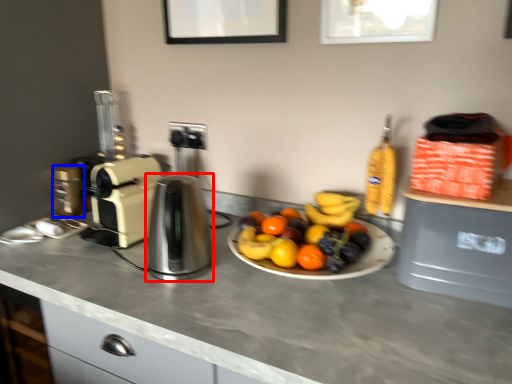
Question: Which of the following is the farthest to the observer, kitchen appliance (highlighted by a red box) or coffee machine (highlighted by a blue box)?

Choices:
 (A) kitchen appliance
 (B) coffee machine

Answer: (B)